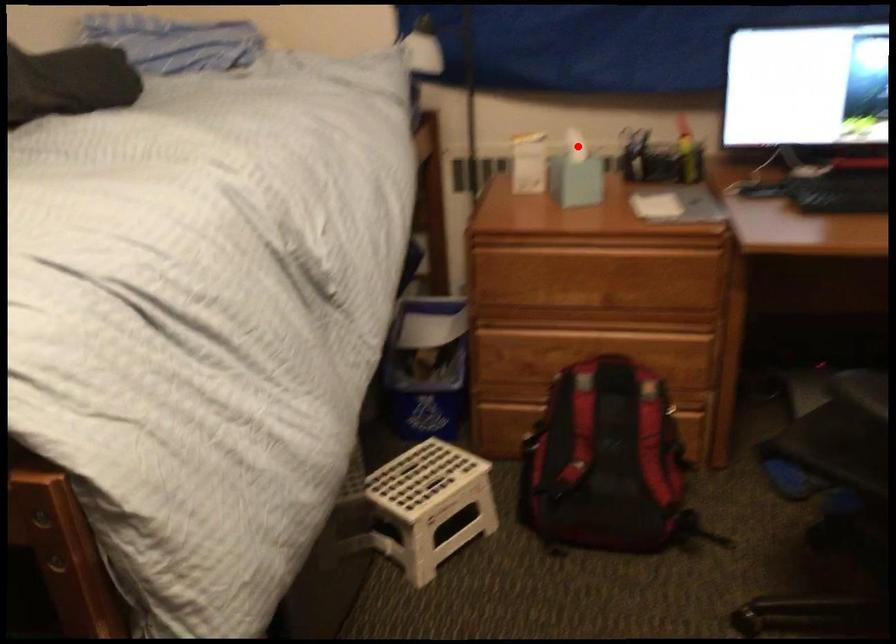
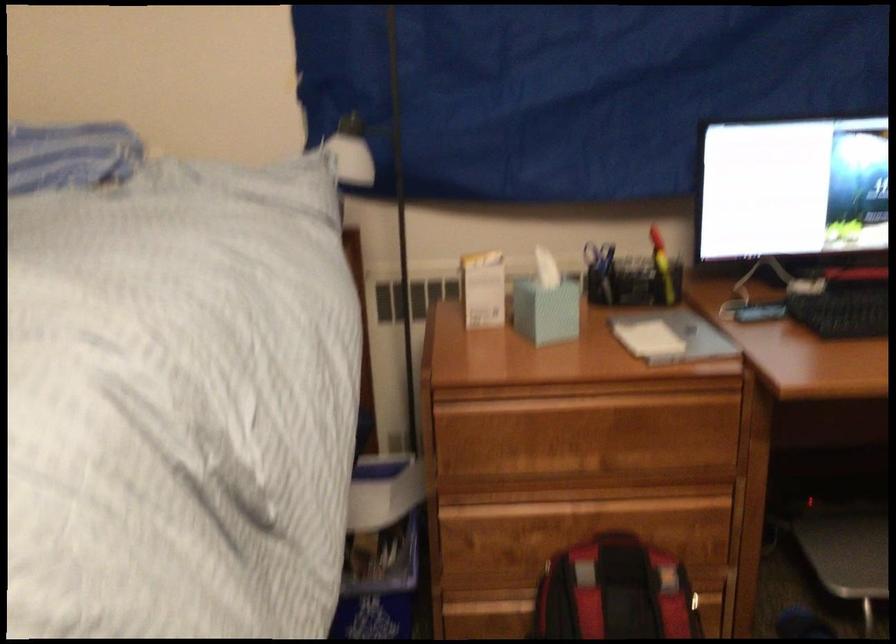
Question: I am providing you with two images of the same scene from different viewpoints. In image1, a red point is highlighted. Considering the same 3D point in image2, which of the following is correct?

Choices:
 (A) It is closer
 (B) It is farther

Answer: (A)